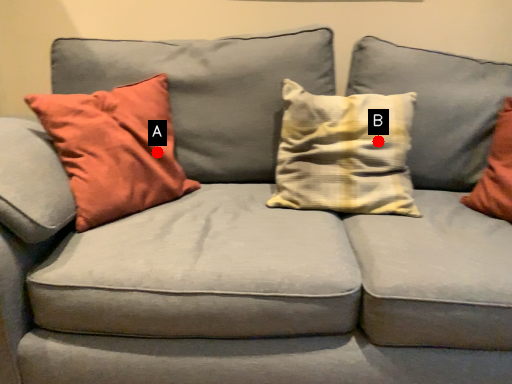
Question: Two points are circled on the image, labeled by A and B beside each circle. Among these points, which one is nearest to the camera?

Choices:
 (A) A is closer
 (B) B is closer

Answer: (B)